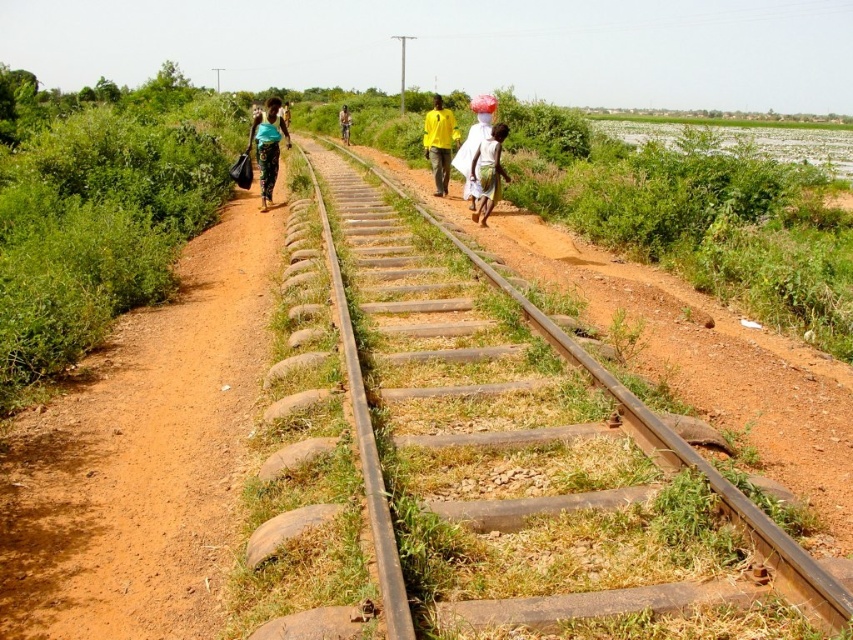
Question: Based on their relative distances, which object is farther from the white cotton cloth at center?

Choices:
 (A) white cloth at center
 (B) white cotton shirt at center

Answer: (B)

Question: Which object is farther from the camera taking this photo?

Choices:
 (A) white cotton shirt at center
 (B) white cotton cloth at center
 (C) matte green shirt at center
 (D) smooth metal track at center

Answer: (A)

Question: Can you confirm if brown dirt path at center is bigger than white cotton shirt at center?

Choices:
 (A) yes
 (B) no

Answer: (B)

Question: Does matte green shirt at center have a larger size compared to yellow matte shirt at center?

Choices:
 (A) no
 (B) yes

Answer: (B)

Question: Among these points, which one is farthest from the camera?

Choices:
 (A) (474, 180)
 (B) (440, 102)
 (C) (260, 145)
 (D) (790, 579)

Answer: (B)

Question: Can you confirm if white cotton cloth at center is bigger than yellow matte shirt at center?

Choices:
 (A) no
 (B) yes

Answer: (A)